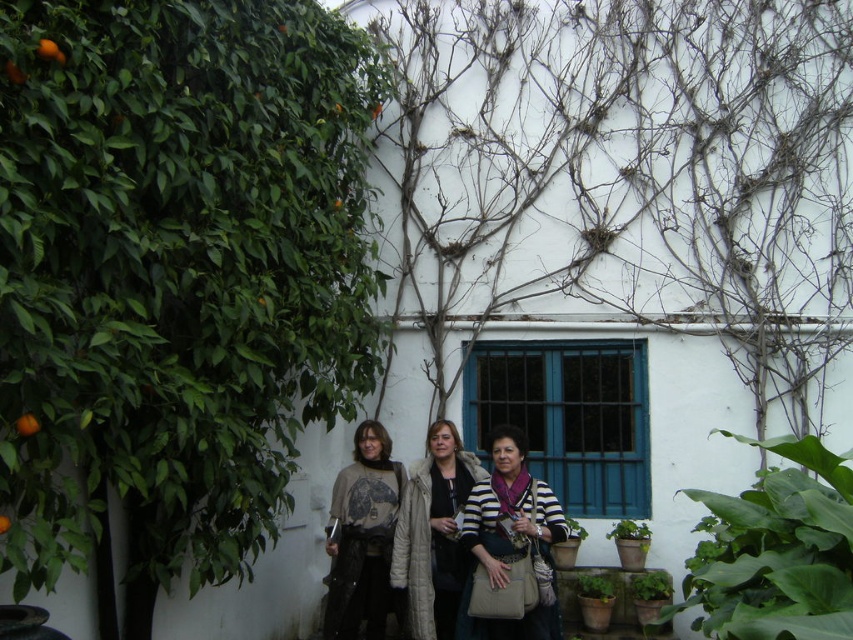
Can you confirm if dry vines at center is wider than orangesmoothfruit at upper left?

Indeed, dry vines at center has a greater width compared to orangesmoothfruit at upper left.

Who is higher up, dry vines at center or orangesmoothfruit at upper left?

dry vines at center is higher up.

Where is `dry vines at center`? dry vines at center is located at coordinates (653, 163).

Which of these two, striped fabric scarf at center or orange matte at left, stands taller?

Standing taller between the two is striped fabric scarf at center.

What do you see at coordinates (509, 548) in the screenshot? I see `striped fabric scarf at center` at bounding box center [509, 548].

At what (x,y) coordinates should I click in order to perform the action: click on striped fabric scarf at center. Please return your answer as a coordinate pair (x, y). Looking at the image, I should click on (509, 548).

Which is above, orangesmoothfruit at left or orangesmoothfruit at upper left?

orangesmoothfruit at upper left

This screenshot has height=640, width=853. I want to click on orangesmoothfruit at left, so click(27, 424).